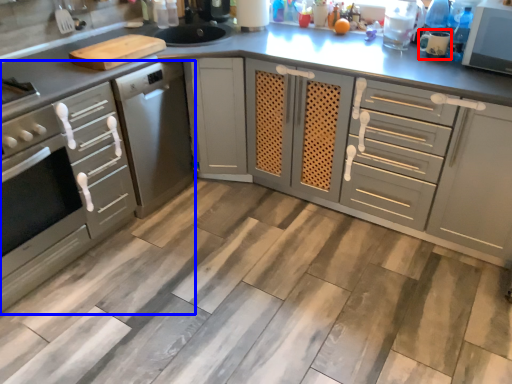
Question: Which of the following is the farthest to the observer, appliance (highlighted by a red box) or cabinetry (highlighted by a blue box)?

Choices:
 (A) appliance
 (B) cabinetry

Answer: (A)